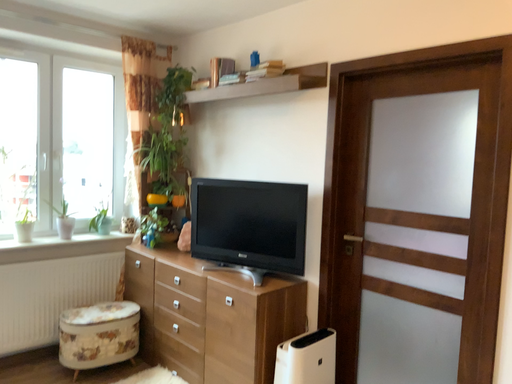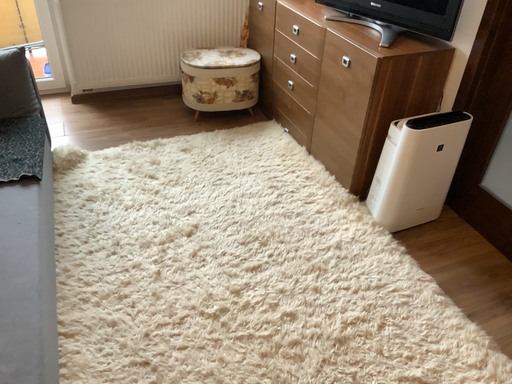
Question: Which way did the camera rotate in the video?

Choices:
 (A) rotated downward
 (B) rotated upward

Answer: (A)